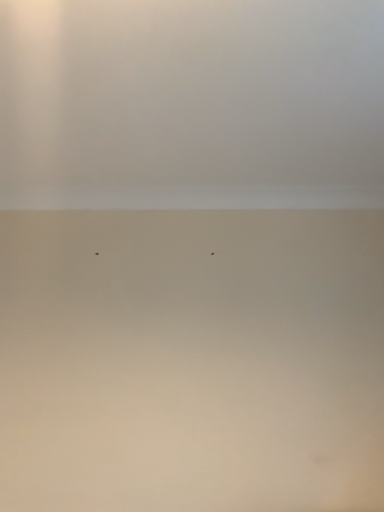
The width and height of the screenshot is (384, 512). What do you see at coordinates (191, 104) in the screenshot?
I see `white matte fog at center` at bounding box center [191, 104].

Measure the distance between white matte fog at center and camera.

white matte fog at center is 38.90 inches from camera.

Identify the location of white matte fog at center. (191, 104).

Find the location of `white matte fog at center`. white matte fog at center is located at coordinates (191, 104).